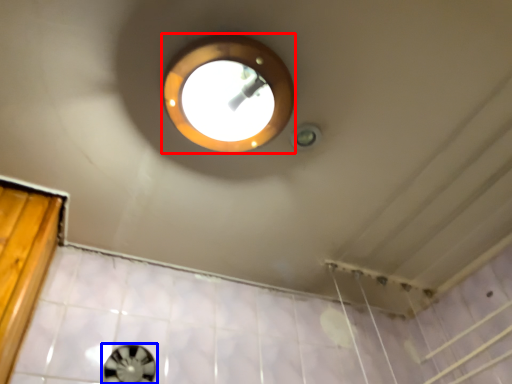
Question: Which of the following is the farthest to the observer, light (highlighted by a red box) or porthole (highlighted by a blue box)?

Choices:
 (A) light
 (B) porthole

Answer: (B)